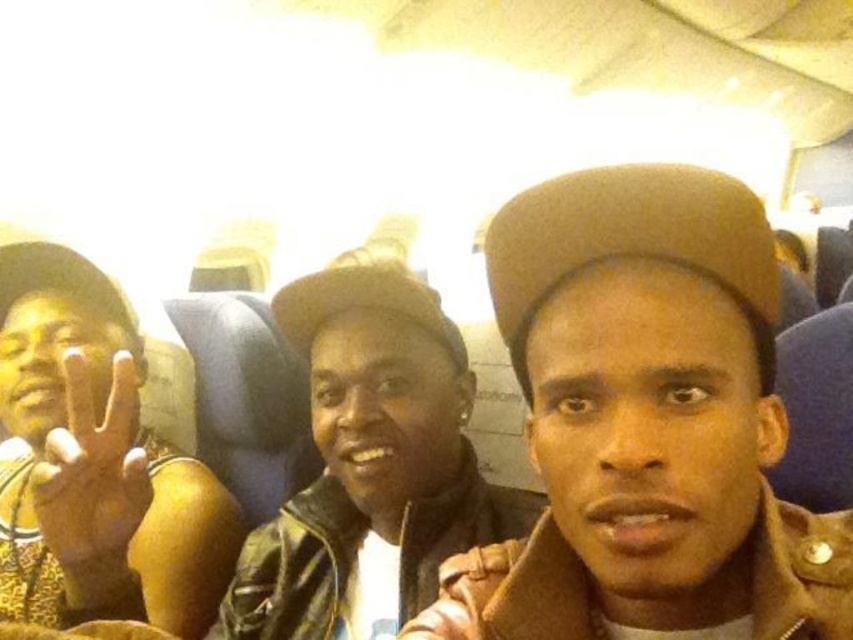
You are an airplane passenger trying to stow a 12 inch wide laptop bag in the overhead compartment. You notice the brown leather jacket at center and the yellow matte hand at left in the image. Which item has enough width to allow the bag to fit alongside it in the compartment?

The brown leather jacket at center has a greater width than the yellow matte hand at left, so the laptop bag may fit alongside the brown leather jacket at center but not the yellow matte hand at left.

You are a flight attendant checking seat assignments. You notice the leather jacket at center and the yellow printed shirt at left. Which clothing item is closer to the front of the airplane cabin?

The leather jacket at center is shorter than the yellow printed shirt at left, so the leather jacket at center is closer to the front of the airplane cabin.